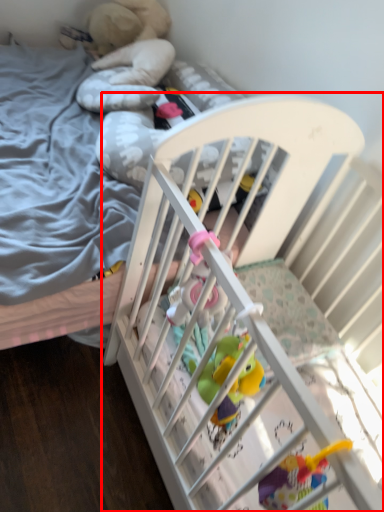
Question: From the image's perspective, what is the correct spatial positioning of infant bed (annotated by the red box) in reference to toy?

Choices:
 (A) above
 (B) below

Answer: (B)